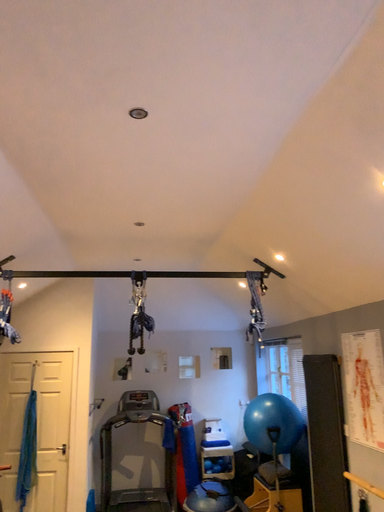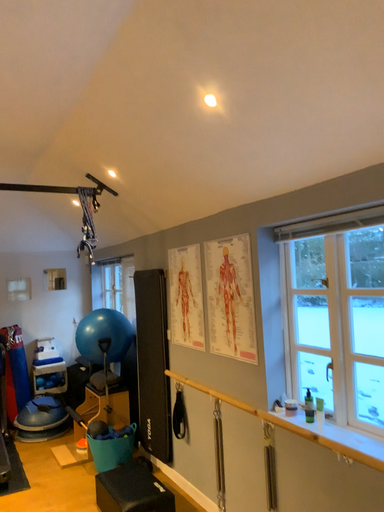
Question: How did the camera likely rotate when shooting the video?

Choices:
 (A) rotated downward
 (B) rotated upward

Answer: (A)